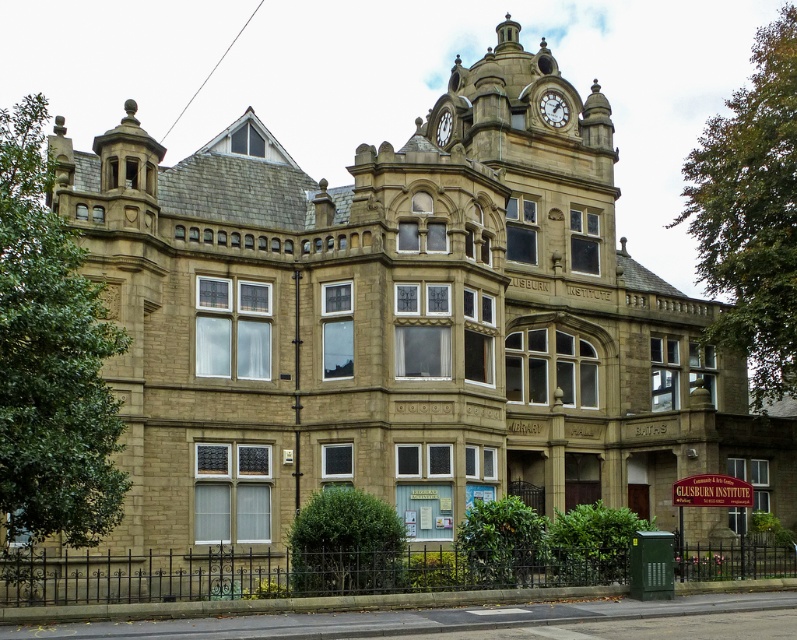
You are standing in front of the grand historic building and notice a point marked at coordinates (552,108). According to the image, what object is located at that point?

The point at (552,108) marks the gold textured clock at upper center.

You are standing at the base of the grand historic building. You want to take a photo of the gold textured clock at upper center using a camera. Considering the distance between them, will you be able to capture the entire clock in your photo without moving closer?

The gold textured clock at upper center and camera are 282.53 feet apart from each other. At this distance, capturing the entire clock in a photo without moving closer may be challenging depending on the camera lens. However, using a wide angle lens or adjusting the camera angle could help include the entire clock in the frame.

You are standing in front of the historic Victorian building and want to take a photo of the gold textured clock at upper center. Given that your camera has a zoom lens with a maximum focal length of 200mm, can you estimate if the clock will be in the center of your frame based on its position?

The gold textured clock at upper center is located at point coordinates, so it will be centered in the frame when using a 200mm lens.